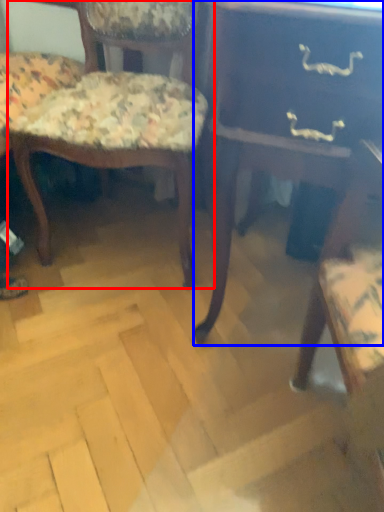
Question: Which point is further to the camera, chair (highlighted by a red box) or table (highlighted by a blue box)?

Choices:
 (A) chair
 (B) table

Answer: (A)